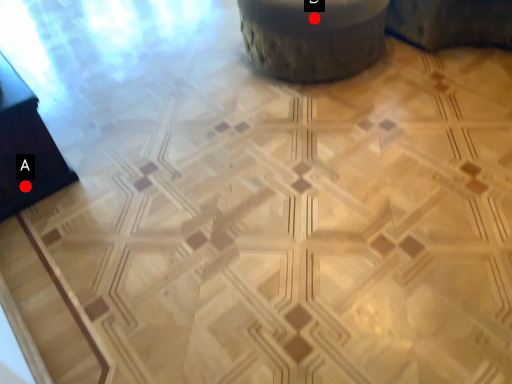
Question: Two points are circled on the image, labeled by A and B beside each circle. Which point is closer to the camera taking this photo?

Choices:
 (A) A is closer
 (B) B is closer

Answer: (A)